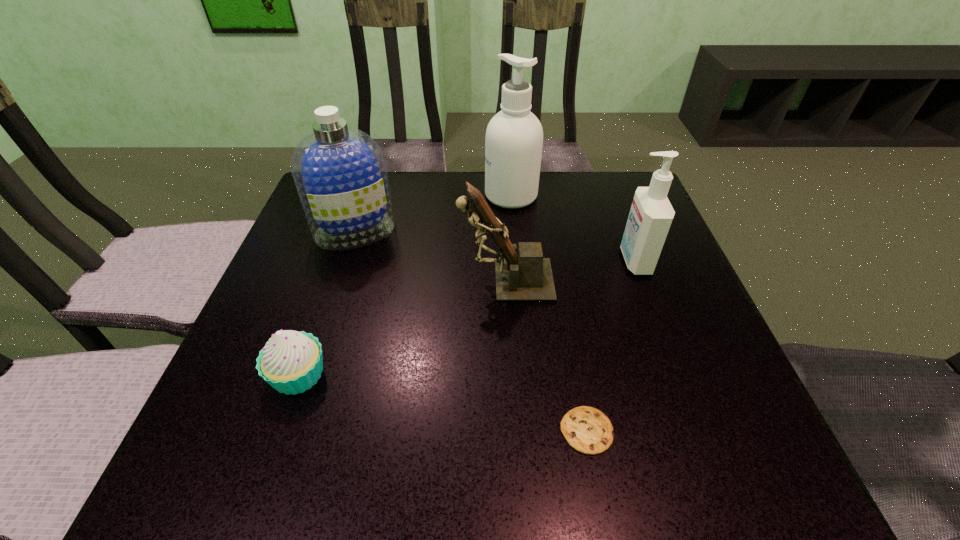
Find the location of a particular element. The width and height of the screenshot is (960, 540). the farthest cleansing agent is located at coordinates (514, 137).

At what (x,y) coordinates should I click in order to perform the action: click on the tallest cleansing agent. Please return your answer as a coordinate pair (x, y). The image size is (960, 540). Looking at the image, I should click on (514, 137).

At what (x,y) coordinates should I click in order to perform the action: click on the leftmost cleansing agent. Please return your answer as a coordinate pair (x, y). Image resolution: width=960 pixels, height=540 pixels. Looking at the image, I should click on (339, 172).

Identify the location of the rightmost object. This screenshot has width=960, height=540. (651, 214).

Identify the location of figurine. (522, 274).

Where is `cupcake`? This screenshot has height=540, width=960. cupcake is located at coordinates (291, 362).

You are a GUI agent. You are given a task and a screenshot of the screen. Output one action in this format:
    pyautogui.click(x=<x>, y=<y>)
    Task: Click on the fifth tallest object
    
    Given the screenshot: What is the action you would take?
    pyautogui.click(x=291, y=362)

This screenshot has height=540, width=960. Identify the location of the shortest object. (588, 430).

Find the location of a particular element. This screenshot has height=540, width=960. the nearest object is located at coordinates (588, 430).

Locate an element on the screen. vacant region located on the front label of the farthest object is located at coordinates click(446, 195).